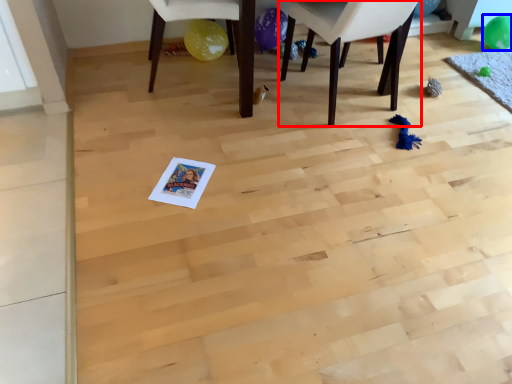
Question: Which object is further to the camera taking this photo, chair (highlighted by a red box) or balloon (highlighted by a blue box)?

Choices:
 (A) chair
 (B) balloon

Answer: (B)